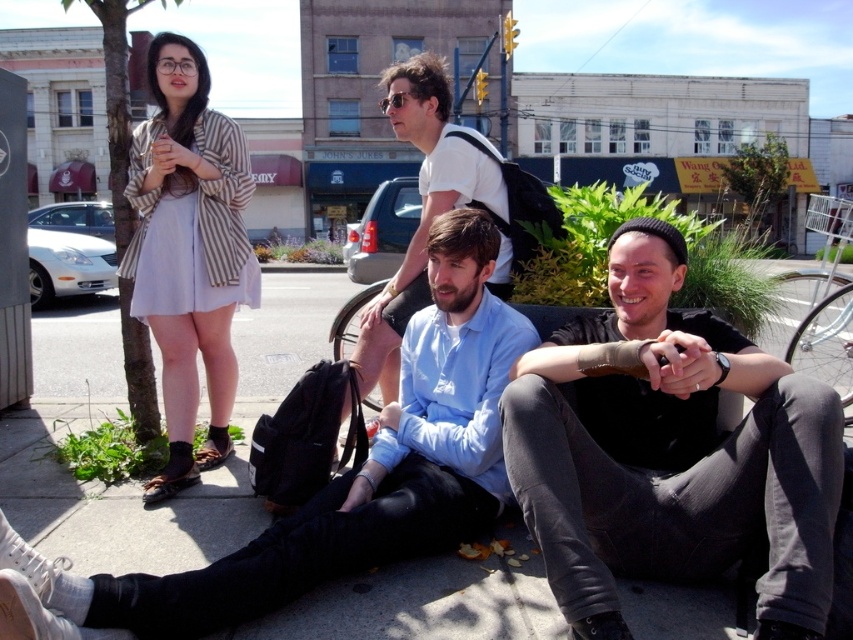
Question: From the image, what is the correct spatial relationship of striped fabric dress at upper left in relation to light blue shirt at center?

Choices:
 (A) above
 (B) below

Answer: (B)

Question: Which of the following is the closest to the observer?

Choices:
 (A) (424, 413)
 (B) (209, 445)

Answer: (A)

Question: Which of the following is the farthest from the observer?

Choices:
 (A) (229, 268)
 (B) (405, 99)
 (C) (780, 627)
 (D) (259, 602)

Answer: (A)

Question: Does striped fabric dress at upper left come behind light blue shirt at center?

Choices:
 (A) no
 (B) yes

Answer: (B)

Question: Which point is farther to the camera?

Choices:
 (A) light blue shirt at center
 (B) black matte shirt at center
 (C) light blue cotton shirt at center

Answer: (A)

Question: Is striped fabric dress at upper left closer to camera compared to light blue shirt at center?

Choices:
 (A) yes
 (B) no

Answer: (B)